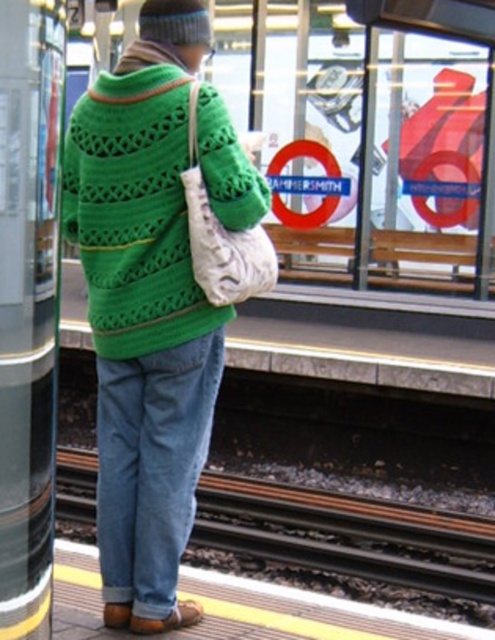
You are a fashion designer observing a person at the train station. You notice the green knitted cardigan at center. Can you determine its exact position relative to the platform edge marked by the yellow tactile paving?

The green knitted cardigan at center is located at point coordinates of (135,209), which places it closer to the platform edge marked by the yellow tactile paving.

You are a photographer taking a picture of the person at the train station. You notice the green knitted sweater at center and the denim at center. Which item should you focus on to ensure it appears clearer in the photo?

The green knitted sweater at center is closer to the viewer than the denim at center, so focusing on it will make it appear clearer in the photo.